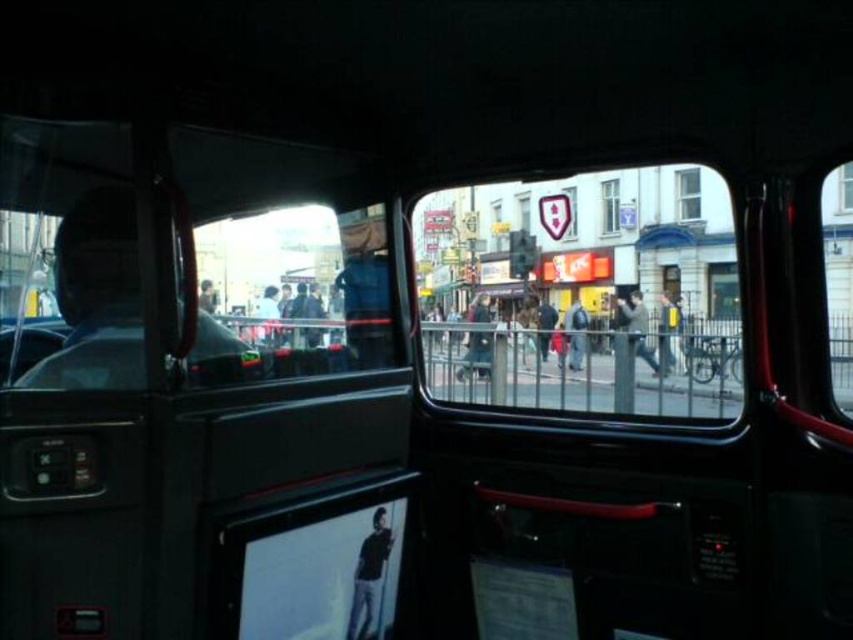
You are a passenger in a taxi and want to know if you can reach the transparent glass window at center from the dark brown leather jacket at center without moving your seat. Can you? Please explain based on the distance between them.

The dark brown leather jacket at center and transparent glass window at center are 13.30 meters apart. Since this distance is quite large, you would need to move your seat or physically reach a significant distance to touch the window, which is not feasible. Therefore, you cannot reach the transparent glass window at center from the dark brown leather jacket at center without moving your seat.

You are a passenger in a taxi and notice a dark brown leather jacket at center. Based on its position, can you determine if it is placed on the front passenger seat or the back seat?

The dark brown leather jacket at center is located at point coordinates suggesting it is placed on the front passenger seat rather than the back seat.